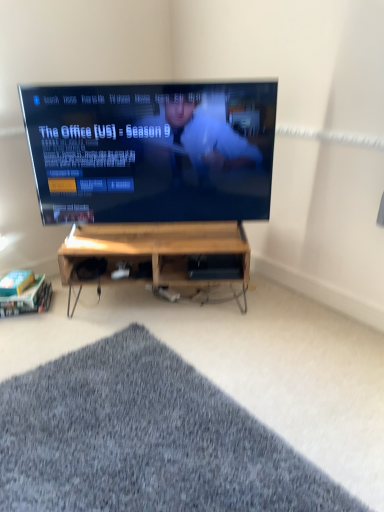
Where is `free space in front of woodenmaterial/texturedesk at center`? free space in front of woodenmaterial/texturedesk at center is located at coordinates (207, 349).